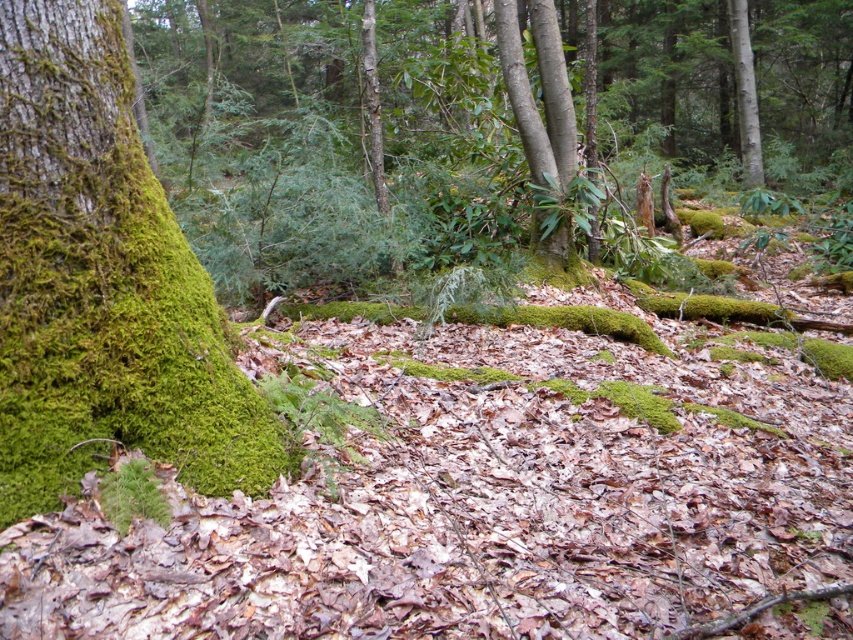
Question: Can you confirm if green mossy tree trunk at left is wider than smooth bark tree at center?

Choices:
 (A) no
 (B) yes

Answer: (B)

Question: Is green mossy tree trunk at left behind smooth bark tree at center?

Choices:
 (A) no
 (B) yes

Answer: (A)

Question: Among these objects, which one is farthest from the camera?

Choices:
 (A) green mossy tree trunk at left
 (B) smooth bark tree at center

Answer: (B)

Question: Among these objects, which one is nearest to the camera?

Choices:
 (A) green mossy tree trunk at left
 (B) smooth bark tree at center

Answer: (A)

Question: Is green mossy tree trunk at left to the right of smooth bark tree at center from the viewer's perspective?

Choices:
 (A) no
 (B) yes

Answer: (A)